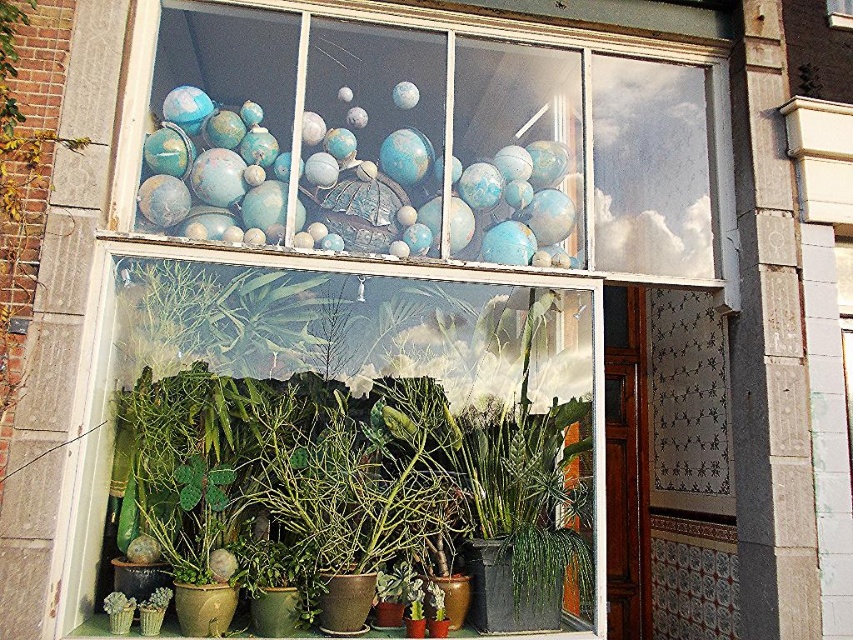
Which is more to the right, green matte plant at center or blue matte globes at upper center?

Positioned to the right is blue matte globes at upper center.

Consider the image. Is green matte plant at center to the left of blue matte globes at upper center from the viewer's perspective?

Indeed, green matte plant at center is positioned on the left side of blue matte globes at upper center.

Between point (422, 428) and point (550, 86), which one is positioned in front?

Point (422, 428) is more forward.

Where is `green matte plant at center`? green matte plant at center is located at coordinates (368, 417).